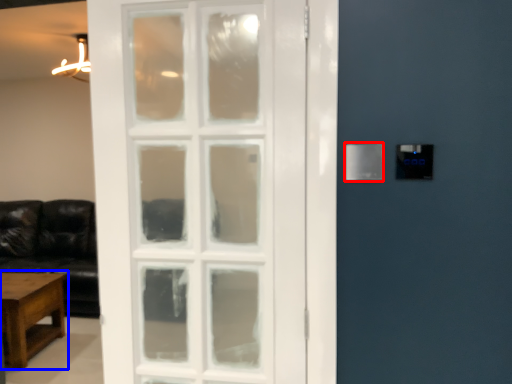
Question: Which point is further to the camera, light switch (highlighted by a red box) or table (highlighted by a blue box)?

Choices:
 (A) light switch
 (B) table

Answer: (B)